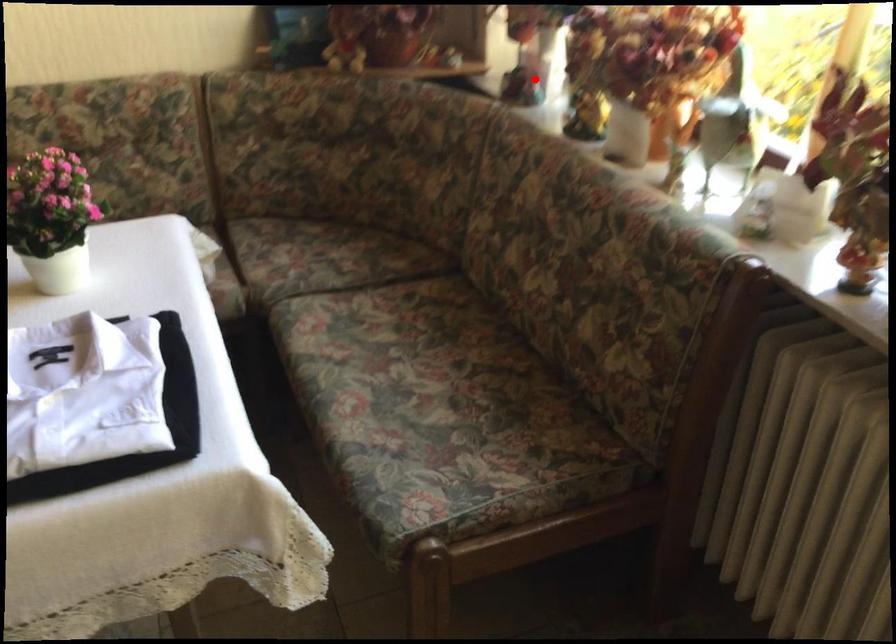
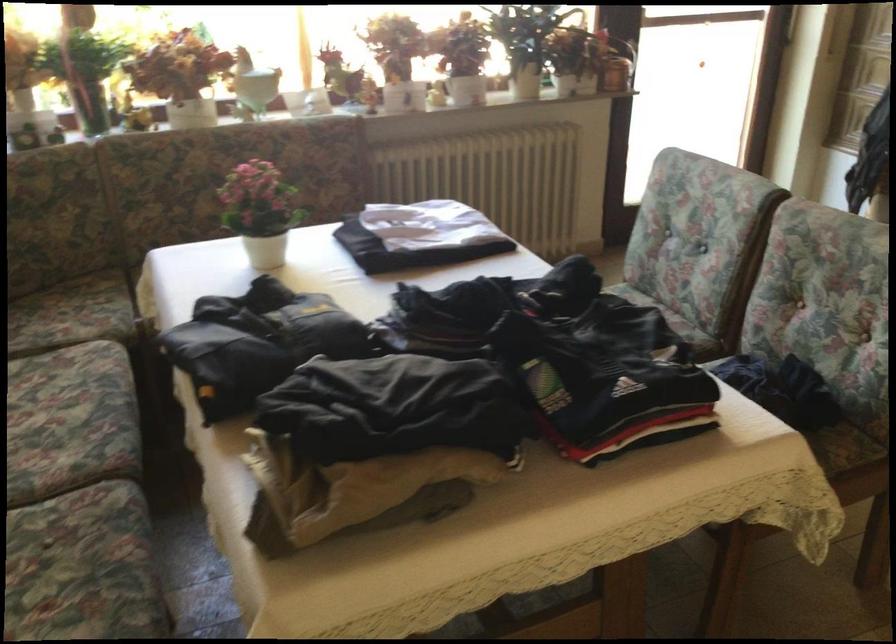
In the second image, find the point that corresponds to the highlighted location in the first image.

(93, 114)